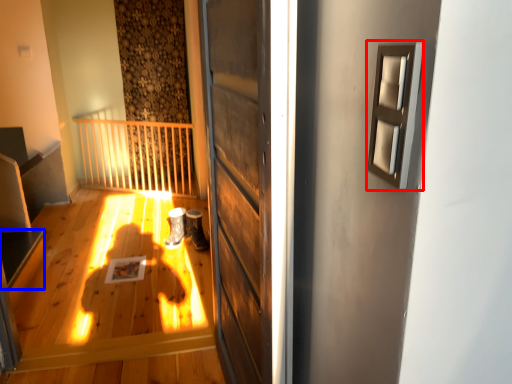
Question: Which of the following is the closest to the observer, window (highlighted by a red box) or stairwell (highlighted by a blue box)?

Choices:
 (A) window
 (B) stairwell

Answer: (A)